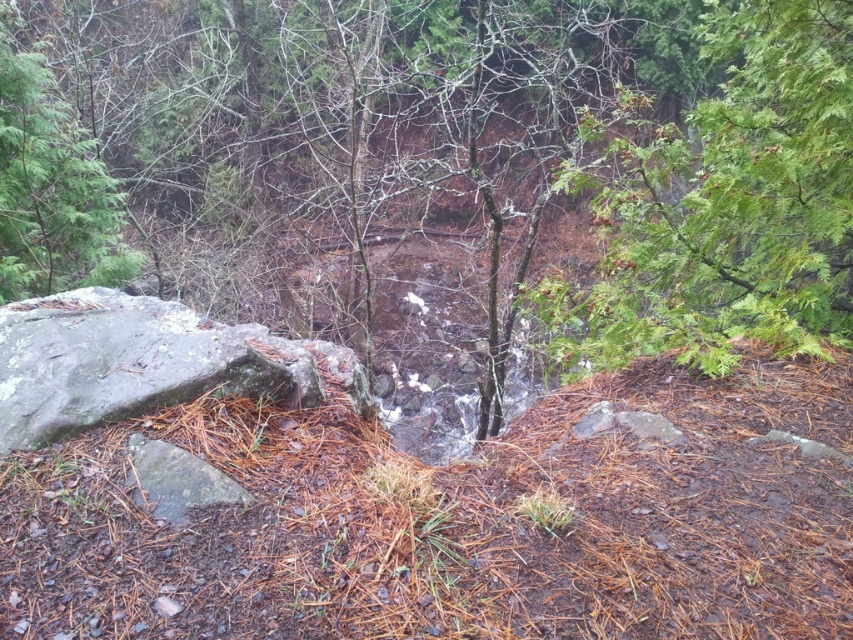
Question: Which point is closer to the camera?

Choices:
 (A) (x=299, y=129)
 (B) (x=30, y=284)

Answer: (B)

Question: Which object is positioned closest to the green matte tree at upper left?

Choices:
 (A) green textured tree at center
 (B) green leafy tree at upper right

Answer: (A)

Question: Can you confirm if green textured tree at center is positioned to the left of green leafy tree at upper right?

Choices:
 (A) yes
 (B) no

Answer: (A)

Question: Which object is positioned farthest from the green leafy tree at upper right?

Choices:
 (A) green matte tree at upper left
 (B) green textured tree at center

Answer: (A)

Question: Can you confirm if green leafy tree at upper right is smaller than green matte tree at upper left?

Choices:
 (A) yes
 (B) no

Answer: (A)

Question: From the image, what is the correct spatial relationship of green textured tree at center in relation to green matte tree at upper left?

Choices:
 (A) above
 (B) below

Answer: (A)